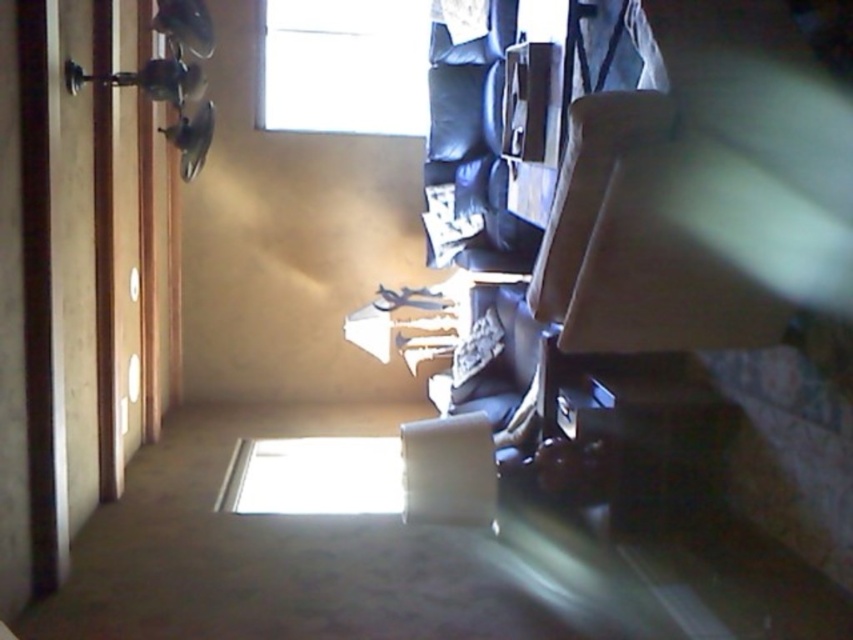
From the picture: Who is more forward, (643, 132) or (404, 500)?

Point (643, 132) is more forward.

How distant is beige fabric armchair at center from matte gray armchair at center?

They are 20.52 inches apart.

Find the location of `beige fabric armchair at center`. beige fabric armchair at center is located at coordinates (552, 268).

Between point (612, 104) and point (281, 19), which one is positioned behind?

Point (281, 19)

Does beige fabric armchair at center come in front of transparent glass window at upper center?

Yes, beige fabric armchair at center is in front of transparent glass window at upper center.

Locate an element on the screen. The image size is (853, 640). beige fabric armchair at center is located at coordinates (552, 268).

This screenshot has height=640, width=853. I want to click on beige fabric armchair at center, so click(552, 268).

Between point (329, 64) and point (440, 456), which one is positioned behind?

Positioned behind is point (329, 64).

Who is taller, transparent glass window at upper center or matte gray armchair at center?

transparent glass window at upper center

Identify the location of transparent glass window at upper center. (345, 67).

Where is `transparent glass window at upper center`? transparent glass window at upper center is located at coordinates (345, 67).